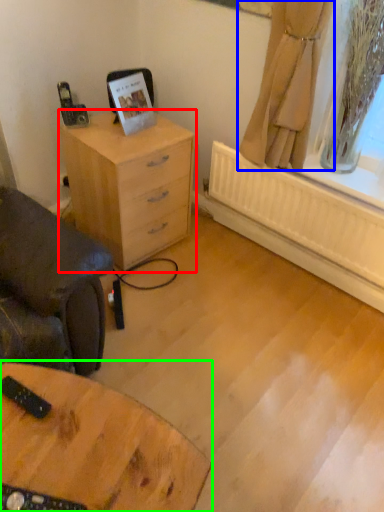
Question: Which object is the farthest from chest of drawers (highlighted by a red box)? Choose among these: curtain (highlighted by a blue box) or table (highlighted by a green box).

Choices:
 (A) curtain
 (B) table

Answer: (B)